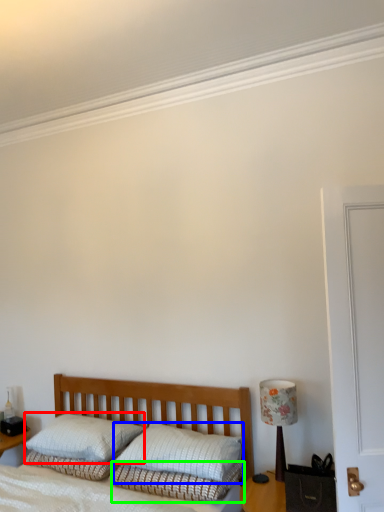
Question: Based on their relative distances, which object is farther from pillow (highlighted by a red box)? Choose from pillow (highlighted by a blue box) and bedding (highlighted by a green box).

Choices:
 (A) pillow
 (B) bedding

Answer: (B)